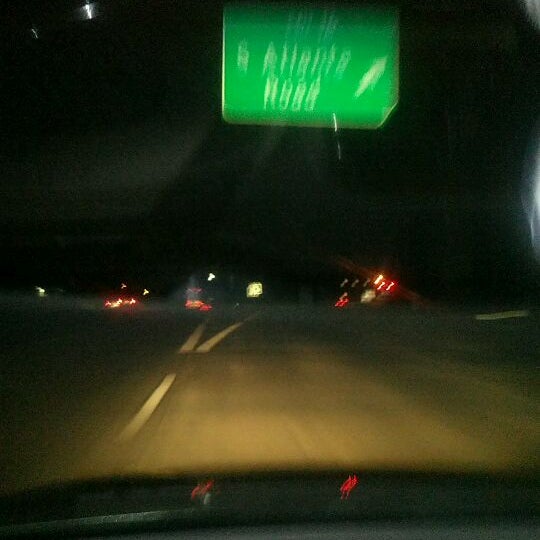
At what (x,y) coordinates should I click in order to perform the action: click on hood. Please return your answer as a coordinate pair (x, y). Looking at the image, I should click on (275, 482).